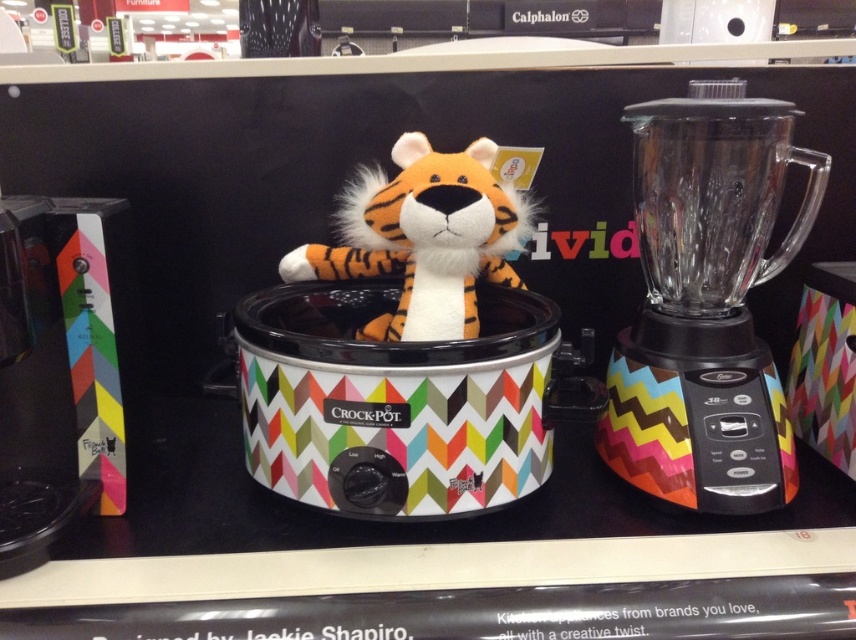
From the picture: How far apart are matte plastic crock pot at center and clear glass blender at right?

They are 9.59 inches apart.

Does matte plastic crock pot at center appear under clear glass blender at right?

Yes, matte plastic crock pot at center is below clear glass blender at right.

Where is `matte plastic crock pot at center`? The image size is (856, 640). matte plastic crock pot at center is located at coordinates (403, 401).

The height and width of the screenshot is (640, 856). What are the coordinates of `matte plastic crock pot at center` in the screenshot? It's located at (403, 401).

Is matte plastic crock pot at center above orange plush tiger at center?

No.

Which is above, matte plastic crock pot at center or orange plush tiger at center?

orange plush tiger at center is higher up.

The image size is (856, 640). Identify the location of matte plastic crock pot at center. (403, 401).

Image resolution: width=856 pixels, height=640 pixels. I want to click on matte plastic crock pot at center, so click(x=403, y=401).

Describe the element at coordinates (706, 301) in the screenshot. I see `clear glass blender at right` at that location.

Is clear glass blender at right bigger than orange plush tiger at center?

Yes, clear glass blender at right is bigger than orange plush tiger at center.

This screenshot has width=856, height=640. I want to click on clear glass blender at right, so click(706, 301).